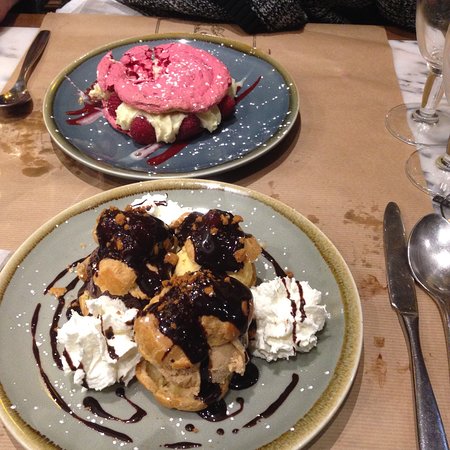
You are a GUI agent. You are given a task and a screenshot of the screen. Output one action in this format:
    pyautogui.click(x=<x>, y=<y>)
    Task: Click on the plate
    
    Given the screenshot: What is the action you would take?
    pyautogui.click(x=339, y=386)